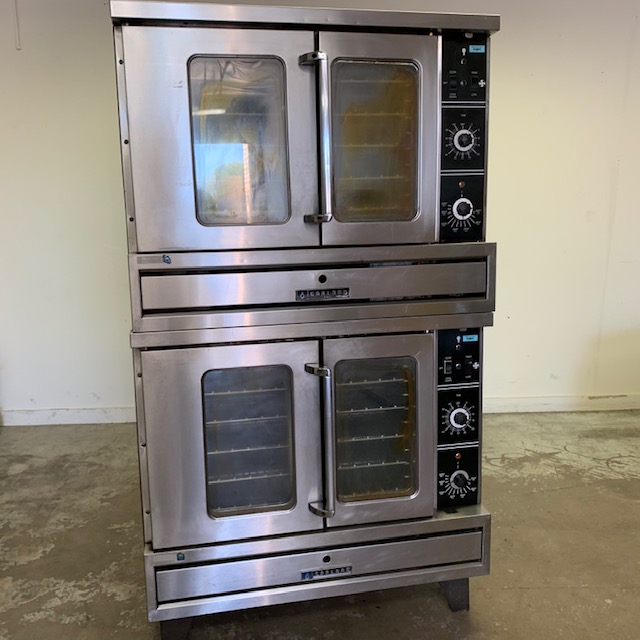
This screenshot has width=640, height=640. I want to click on oven switches, so click(x=448, y=367), click(x=454, y=86).